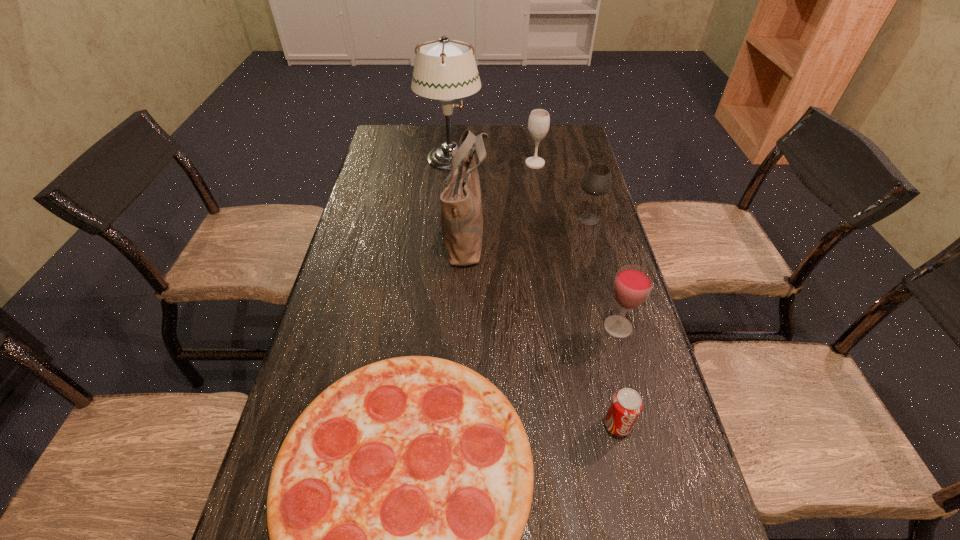
The width and height of the screenshot is (960, 540). Find the location of `free space located on the back of the second nearest wineglass`. free space located on the back of the second nearest wineglass is located at coordinates (578, 179).

You are a GUI agent. You are given a task and a screenshot of the screen. Output one action in this format:
    pyautogui.click(x=<x>, y=<y>)
    Task: Click on the free location located 0.390m on the left of the fifth farthest object
    
    Given the screenshot: What is the action you would take?
    pyautogui.click(x=438, y=327)

Where is `vacant point located on the logo side of the sixth tallest object`? vacant point located on the logo side of the sixth tallest object is located at coordinates (633, 492).

At what (x,y) coordinates should I click in order to perform the action: click on object that is at the far edge. Please return your answer as a coordinate pair (x, y). Looking at the image, I should click on (444, 69).

You are a GUI agent. You are given a task and a screenshot of the screen. Output one action in this format:
    pyautogui.click(x=<x>, y=<y>)
    Task: Click on the soda can positioned at the right edge
    
    Given the screenshot: What is the action you would take?
    pyautogui.click(x=626, y=405)

Image resolution: width=960 pixels, height=540 pixels. In order to click on vacant space at the far edge in this screenshot , I will do `click(508, 132)`.

Where is `vacant region at the left edge of the desktop`? This screenshot has height=540, width=960. vacant region at the left edge of the desktop is located at coordinates (402, 185).

The width and height of the screenshot is (960, 540). I want to click on free space at the right edge of the desktop, so click(x=546, y=179).

Locate an element on the screen. This screenshot has width=960, height=540. vacant space at the far left corner of the desktop is located at coordinates (384, 144).

You are a GUI agent. You are given a task and a screenshot of the screen. Output one action in this format:
    pyautogui.click(x=<x>, y=<y>)
    Task: Click on the vacant area between the shoulder bag and the second nearest wineglass
    Image resolution: width=960 pixels, height=540 pixels.
    Given the screenshot: What is the action you would take?
    pyautogui.click(x=527, y=227)